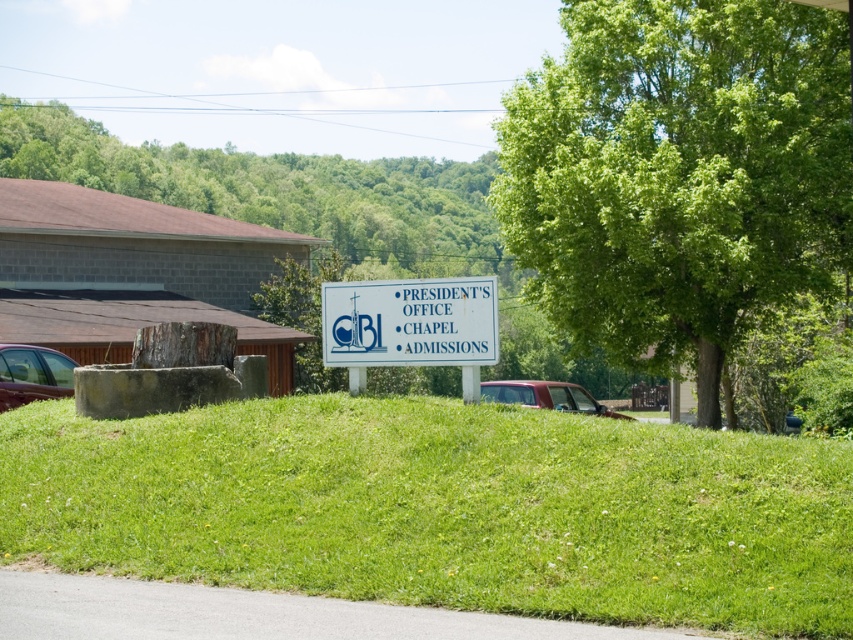
This screenshot has width=853, height=640. What do you see at coordinates (32, 374) in the screenshot? I see `matte black car at lower left` at bounding box center [32, 374].

Measure the distance between matte black car at lower left and camera.

They are 18.82 meters apart.

Where is `matte black car at lower left`? The width and height of the screenshot is (853, 640). matte black car at lower left is located at coordinates (32, 374).

Between green leafy tree at center and matte black car at lower left, which one has more height?

Standing taller between the two is green leafy tree at center.

Does point (712, 45) lie behind point (67, 358)?

Yes, it is.

Is point (744, 141) behind point (18, 355)?

That is True.

I want to click on green leafy tree at center, so click(679, 173).

Who is shorter, green grassy hill at center or metallic red truck at center?

Standing shorter between the two is green grassy hill at center.

How distant is green grassy hill at center from metallic red truck at center?

green grassy hill at center and metallic red truck at center are 72.52 feet apart.

Who is more distant from viewer, [625,436] or [529,403]?

The point [529,403] is behind.

At what (x,y) coordinates should I click in order to perform the action: click on green grassy hill at center. Please return your answer as a coordinate pair (x, y). Image resolution: width=853 pixels, height=640 pixels. Looking at the image, I should click on (444, 508).